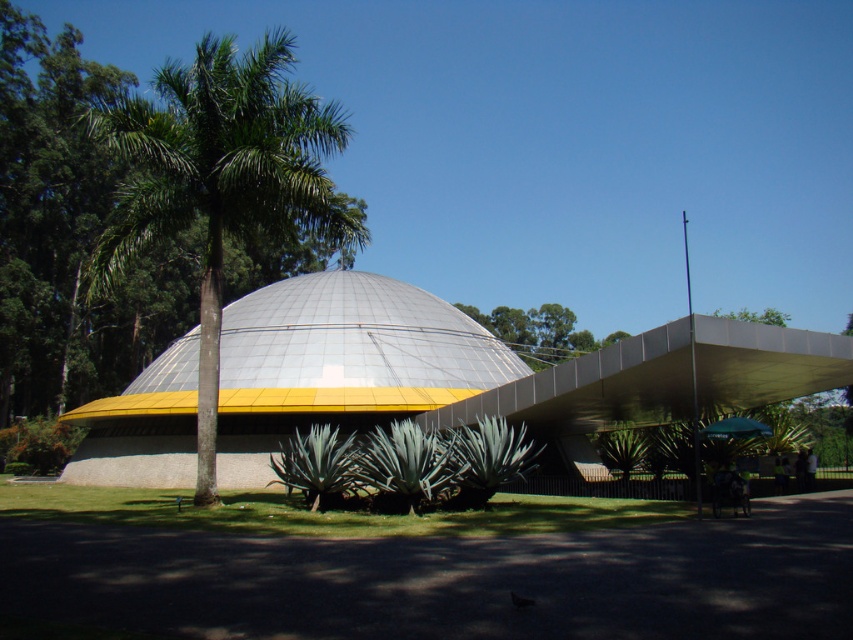
Based on the photo, can you confirm if metallic dome at center is positioned to the right of green leafy tree at upper center?

In fact, metallic dome at center is to the left of green leafy tree at upper center.

Can you confirm if metallic dome at center is taller than green leafy tree at upper center?

No.

Measure the distance between point (157, 374) and camera.

Point (157, 374) and camera are 100.62 feet apart from each other.

Locate an element on the screen. metallic dome at center is located at coordinates (352, 348).

Is green leafy palm tree at center taller than green leafy tree at upper center?

Correct, green leafy palm tree at center is much taller as green leafy tree at upper center.

Which is below, green leafy palm tree at center or green leafy tree at upper center?

Positioned lower is green leafy tree at upper center.

What do you see at coordinates (222, 180) in the screenshot?
I see `green leafy palm tree at center` at bounding box center [222, 180].

Find the location of `green leafy palm tree at center`. green leafy palm tree at center is located at coordinates (222, 180).

Between point (115, 115) and point (265, 353), which one is positioned in front?

Point (115, 115) is more forward.

In the scene shown: Is green leafy palm tree at center below metallic dome at center?

Actually, green leafy palm tree at center is above metallic dome at center.

Describe the element at coordinates (222, 180) in the screenshot. I see `green leafy palm tree at center` at that location.

Find the location of a particular element. green leafy palm tree at center is located at coordinates (222, 180).